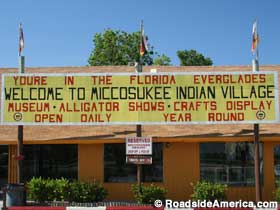
Locate an element on the screen. Image resolution: width=280 pixels, height=210 pixels. black trashcan liner is located at coordinates (18, 185).